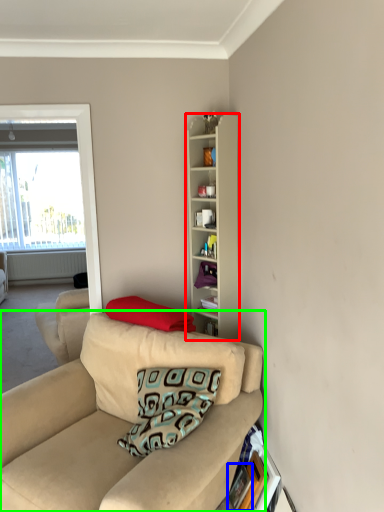
Question: Estimate the real-world distances between objects in this image. Which object is farther from cabinetry (highlighted by a red box), picture frame (highlighted by a blue box) or studio couch (highlighted by a green box)?

Choices:
 (A) picture frame
 (B) studio couch

Answer: (A)